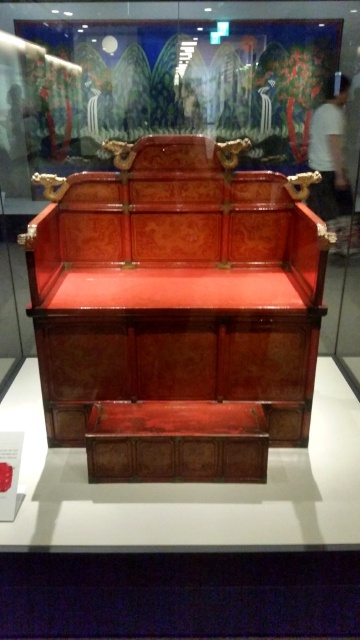
Question: Can you confirm if wooden carved bench at center is positioned to the right of shiny brown wooden chest at center?

Choices:
 (A) yes
 (B) no

Answer: (B)

Question: Where is wooden carved bench at center located in relation to shiny brown wooden chest at center in the image?

Choices:
 (A) right
 (B) left

Answer: (B)

Question: Is the position of wooden carved bench at center more distant than that of shiny brown wooden chest at center?

Choices:
 (A) yes
 (B) no

Answer: (B)

Question: Which point is farther from the camera taking this photo?

Choices:
 (A) (222, 291)
 (B) (180, 472)

Answer: (A)

Question: Among these objects, which one is nearest to the camera?

Choices:
 (A) wooden carved bench at center
 (B) shiny brown wooden chest at center

Answer: (A)